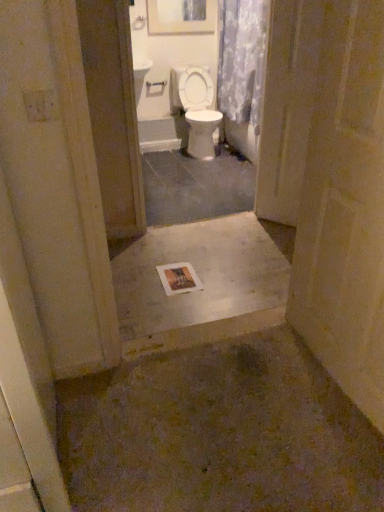
Find the location of a particular element. Image resolution: width=384 pixels, height=512 pixels. blank space situated above smooth concrete slab at center (from a real-world perspective) is located at coordinates (203, 272).